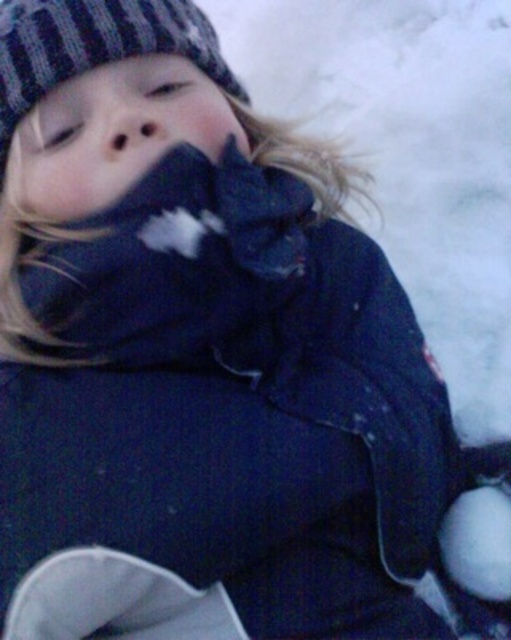
Can you confirm if knitted woolen hat at upper left is shorter than matte black nose at center?

Incorrect, knitted woolen hat at upper left's height does not fall short of matte black nose at center's.

Can you confirm if knitted woolen hat at upper left is smaller than matte black nose at center?

No, knitted woolen hat at upper left is not smaller than matte black nose at center.

Is point (6, 115) less distant than point (159, 150)?

No, it is not.

I want to click on knitted woolen hat at upper left, so click(94, 45).

Which of these two, knitted woolen hat at upper left or white fluffy snowball at lower right, stands taller?

knitted woolen hat at upper left

Is knitted woolen hat at upper left taller than white fluffy snowball at lower right?

Indeed, knitted woolen hat at upper left has a greater height compared to white fluffy snowball at lower right.

The width and height of the screenshot is (511, 640). What do you see at coordinates (94, 45) in the screenshot? I see `knitted woolen hat at upper left` at bounding box center [94, 45].

At what (x,y) coordinates should I click in order to perform the action: click on knitted woolen hat at upper left. Please return your answer as a coordinate pair (x, y). Looking at the image, I should click on (94, 45).

What do you see at coordinates (478, 541) in the screenshot? The image size is (511, 640). I see `white fluffy snowball at lower right` at bounding box center [478, 541].

Is white fluffy snowball at lower right below matte black nose at center?

Yes, white fluffy snowball at lower right is below matte black nose at center.

Is point (489, 556) more distant than point (129, 150)?

Yes, it is behind point (129, 150).

Locate an element on the screen. white fluffy snowball at lower right is located at coordinates (478, 541).